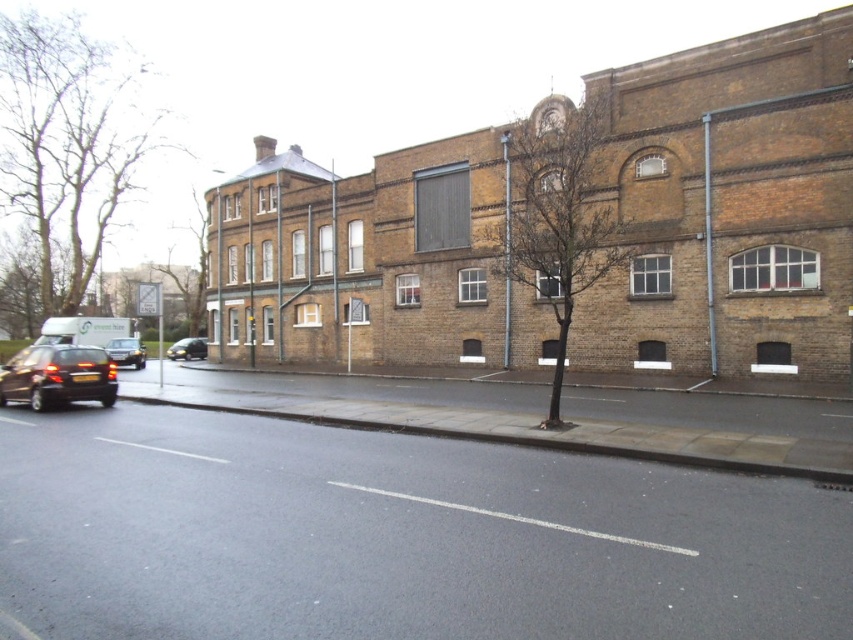
You are standing on the sidewalk in front of the building and want to walk towards the two points marked in the image. Which point, point [109,364] or point [202,342], will you reach first?

You will reach point [109,364] first because it is closer to you than point [202,342].